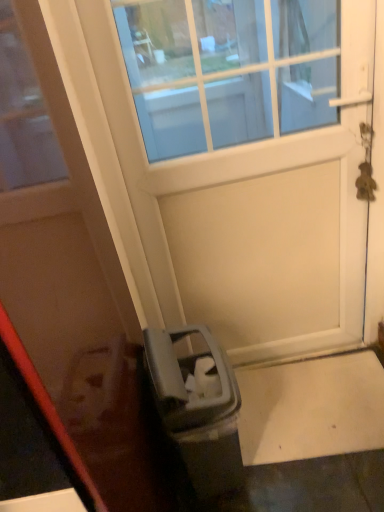
What is the approximate height of white matte door at center, which appears as the second door when viewed from the right?

white matte door at center, which appears as the second door when viewed from the right, is 1.37 meters tall.

Locate an element on the screen. Image resolution: width=384 pixels, height=512 pixels. white matte door at center, positioned as the 1th door in left-to-right order is located at coordinates (67, 285).

Measure the distance between point (56,153) and camera.

Point (56,153) and camera are 30.79 inches apart.

Describe the element at coordinates (67, 285) in the screenshot. The height and width of the screenshot is (512, 384). I see `white matte door at center, which appears as the second door when viewed from the right` at that location.

Describe the element at coordinates (244, 167) in the screenshot. I see `white matte door at center, which is counted as the 2th door, starting from the left` at that location.

Image resolution: width=384 pixels, height=512 pixels. I want to click on white matte door at center, which is the 1th door from right to left, so click(244, 167).

Image resolution: width=384 pixels, height=512 pixels. Identify the location of white matte door at center, positioned as the 1th door in left-to-right order. (67, 285).

Considering the relative positions of white matte door at center, which is the 1th door from right to left, and white matte door at center, which appears as the second door when viewed from the right, in the image provided, is white matte door at center, which is the 1th door from right to left, to the left of white matte door at center, which appears as the second door when viewed from the right, from the viewer's perspective?

In fact, white matte door at center, which is the 1th door from right to left, is to the right of white matte door at center, which appears as the second door when viewed from the right.

Considering their positions, is white matte door at center, which is the 1th door from right to left, located in front of or behind white matte door at center, which appears as the second door when viewed from the right?

Clearly, white matte door at center, which is the 1th door from right to left, is behind white matte door at center, which appears as the second door when viewed from the right.

Which point is more forward, (167, 208) or (59, 334)?

The point (59, 334) is in front.

From the image's perspective, between white matte door at center, which is the 1th door from right to left, and white matte door at center, which appears as the second door when viewed from the right, which one is located above?

white matte door at center, which is the 1th door from right to left.

From a real-world perspective, which object rests below the other?

From a 3D spatial view, white matte door at center, which is the 1th door from right to left, is below.

Between white matte door at center, which is the 1th door from right to left, and white matte door at center, positioned as the 1th door in left-to-right order, which one has larger width?

With larger width is white matte door at center, positioned as the 1th door in left-to-right order.

Who is shorter, white matte door at center, which is the 1th door from right to left, or white matte door at center, which appears as the second door when viewed from the right?

With less height is white matte door at center, which is the 1th door from right to left.

Does white matte door at center, which is the 1th door from right to left, have a larger size compared to white matte door at center, positioned as the 1th door in left-to-right order?

No.

Choose the correct answer: Is white matte door at center, which is the 1th door from right to left, inside white matte door at center, which appears as the second door when viewed from the right, or outside it?

white matte door at center, which is the 1th door from right to left, exists outside the volume of white matte door at center, which appears as the second door when viewed from the right.

Consider the image. Is white matte door at center, which is the 1th door from right to left, next to white matte door at center, which appears as the second door when viewed from the right, and touching it?

There is a gap between white matte door at center, which is the 1th door from right to left, and white matte door at center, which appears as the second door when viewed from the right.

Is white matte door at center, which is counted as the 2th door, starting from the left, oriented towards white matte door at center, positioned as the 1th door in left-to-right order?

No, white matte door at center, which is counted as the 2th door, starting from the left, is not oriented towards white matte door at center, positioned as the 1th door in left-to-right order.

How different are the orientations of white matte door at center, which is the 1th door from right to left, and white matte door at center, which appears as the second door when viewed from the right, in degrees?

There is a 2.27-degree angle between the facing directions of white matte door at center, which is the 1th door from right to left, and white matte door at center, which appears as the second door when viewed from the right.

Could you measure the distance between white matte door at center, which is counted as the 2th door, starting from the left, and white matte door at center, which appears as the second door when viewed from the right?

A distance of 30.33 inches exists between white matte door at center, which is counted as the 2th door, starting from the left, and white matte door at center, which appears as the second door when viewed from the right.

At what (x,y) coordinates should I click in order to perform the action: click on door to the left of white matte door at center, which is counted as the 2th door, starting from the left. Please return your answer as a coordinate pair (x, y). This screenshot has width=384, height=512. Looking at the image, I should click on (67, 285).

Based on the photo, does white matte door at center, positioned as the 1th door in left-to-right order, appear on the right side of white matte door at center, which is the 1th door from right to left?

No, white matte door at center, positioned as the 1th door in left-to-right order, is not to the right of white matte door at center, which is the 1th door from right to left.

Which object is closer to the camera, white matte door at center, which appears as the second door when viewed from the right, or white matte door at center, which is counted as the 2th door, starting from the left?

white matte door at center, which appears as the second door when viewed from the right, is more forward.

Is point (12, 110) in front of point (323, 256)?

That is True.

From the image's perspective, between white matte door at center, positioned as the 1th door in left-to-right order, and white matte door at center, which is counted as the 2th door, starting from the left, who is located below?

white matte door at center, positioned as the 1th door in left-to-right order.

From a real-world perspective, is white matte door at center, which appears as the second door when viewed from the right, beneath white matte door at center, which is the 1th door from right to left?

No, from a real-world perspective, white matte door at center, which appears as the second door when viewed from the right, is not below white matte door at center, which is the 1th door from right to left.

Can you confirm if white matte door at center, positioned as the 1th door in left-to-right order, is thinner than white matte door at center, which is the 1th door from right to left?

In fact, white matte door at center, positioned as the 1th door in left-to-right order, might be wider than white matte door at center, which is the 1th door from right to left.

From their relative heights in the image, would you say white matte door at center, positioned as the 1th door in left-to-right order, is taller or shorter than white matte door at center, which is the 1th door from right to left?

white matte door at center, positioned as the 1th door in left-to-right order, is taller than white matte door at center, which is the 1th door from right to left.

Consider the image. Between white matte door at center, which appears as the second door when viewed from the right, and white matte door at center, which is the 1th door from right to left, which one has smaller size?

white matte door at center, which is the 1th door from right to left, is smaller.

Choose the correct answer: Is white matte door at center, positioned as the 1th door in left-to-right order, inside white matte door at center, which is the 1th door from right to left, or outside it?

The correct answer is: outside.

Are white matte door at center, positioned as the 1th door in left-to-right order, and white matte door at center, which is the 1th door from right to left, far apart?

No, white matte door at center, positioned as the 1th door in left-to-right order, is in close proximity to white matte door at center, which is the 1th door from right to left.

Is white matte door at center, which appears as the second door when viewed from the right, facing away from white matte door at center, which is counted as the 2th door, starting from the left?

No, white matte door at center, which appears as the second door when viewed from the right, is not facing the opposite direction of white matte door at center, which is counted as the 2th door, starting from the left.

How many degrees apart are the facing directions of white matte door at center, positioned as the 1th door in left-to-right order, and white matte door at center, which is counted as the 2th door, starting from the left?

The facing directions of white matte door at center, positioned as the 1th door in left-to-right order, and white matte door at center, which is counted as the 2th door, starting from the left, are 2.27 degrees apart.

Identify the location of door to the left of white matte door at center, which is the 1th door from right to left. The height and width of the screenshot is (512, 384). (67, 285).

Locate an element on the screen. door that appears behind the white matte door at center, positioned as the 1th door in left-to-right order is located at coordinates (244, 167).

The image size is (384, 512). I want to click on door located on the left of white matte door at center, which is the 1th door from right to left, so click(67, 285).